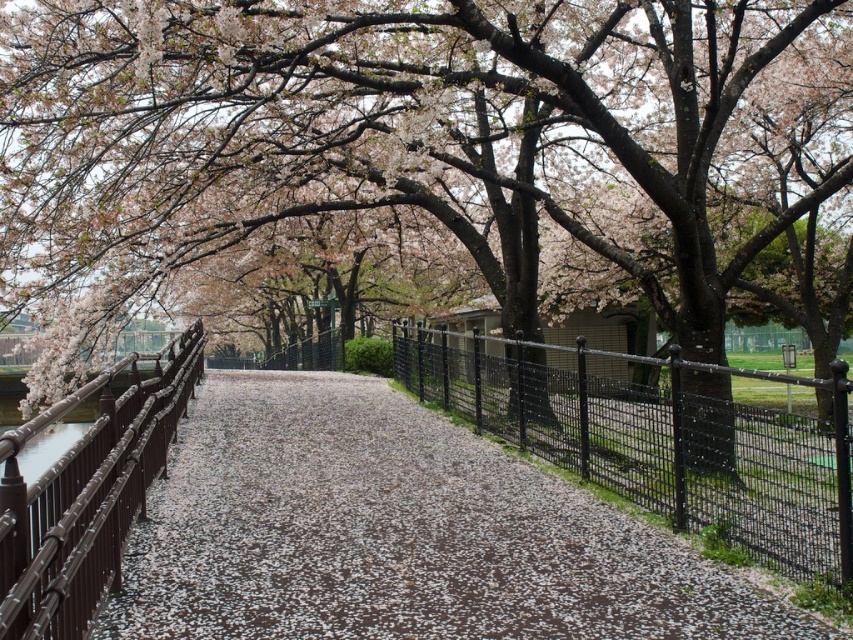
Question: Can you confirm if black metal fence at center is positioned to the right of brown wrought iron fence at left?

Choices:
 (A) yes
 (B) no

Answer: (A)

Question: Which point is closer to the camera taking this photo?

Choices:
 (A) (199, 490)
 (B) (132, 413)
 (C) (654, 424)

Answer: (B)

Question: Which of the following is the farthest from the observer?

Choices:
 (A) (596, 397)
 (B) (78, 448)
 (C) (653, 579)

Answer: (A)

Question: Is black metal fence at center closer to camera compared to brown wrought iron fence at left?

Choices:
 (A) yes
 (B) no

Answer: (B)

Question: Can you confirm if white gravel path at center is bigger than brown wrought iron fence at left?

Choices:
 (A) no
 (B) yes

Answer: (A)

Question: Which of the following is the closest to the observer?

Choices:
 (A) (109, 464)
 (B) (469, 518)
 (C) (671, 396)

Answer: (A)